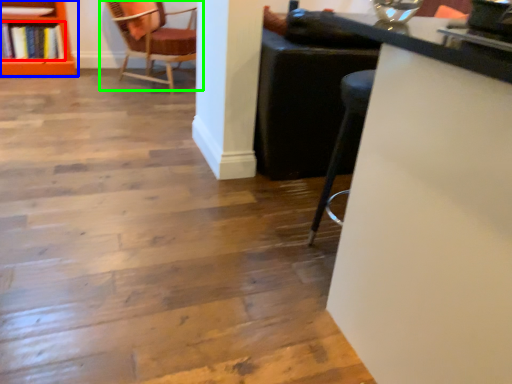
Question: Based on their relative distances, which object is farther from book (highlighted by a red box)? Choose from shelf (highlighted by a blue box) and chair (highlighted by a green box).

Choices:
 (A) shelf
 (B) chair

Answer: (B)